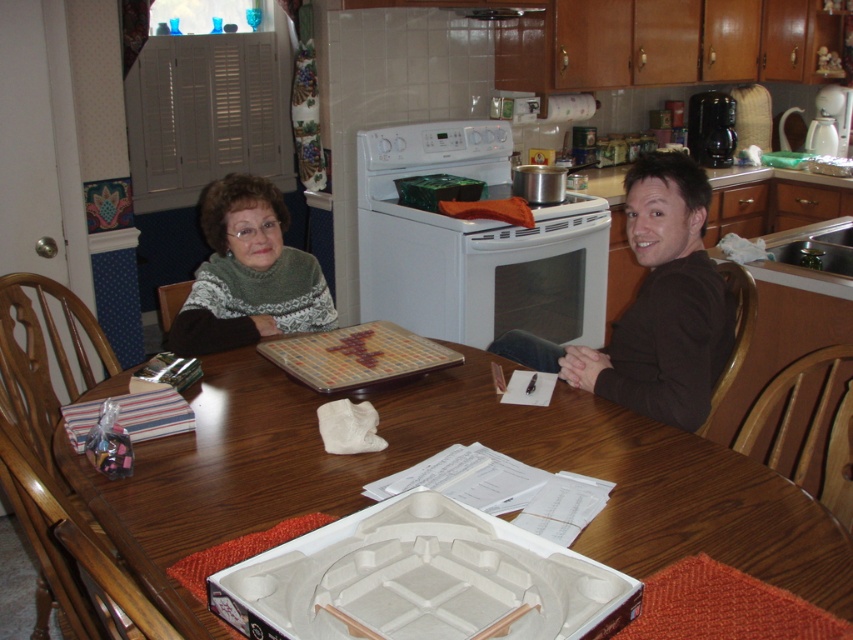
You are planning to place a rectangular gift box that is 2 feet wide on the wooden table at center. Considering the green knitted sweater at upper left is already placed there, will the gift box fit on the table without overlapping the sweater?

The wooden table at center is wider than the green knitted sweater at upper left. Since the table is wider, there is enough space to place the gift box without overlapping the sweater as long as it is positioned appropriately.

You are a chef preparing to cook a meal. You need to place a hot pan on the wooden table at center and the white glossy stove at center. Which surface is more suitable for the pan to prevent burning the table?

The white glossy stove at center is more suitable because it has a greater height than the wooden table at center, making it better for placing hot pans without damaging the surface.

You are a guest in this kitchen and want to place a small plate on the wooden table at center without blocking the green knitted sweater at upper left. Is this possible?

The wooden table at center is positioned under the green knitted sweater at upper left, so placing a small plate on the table would not block the sweater since it is located below it.